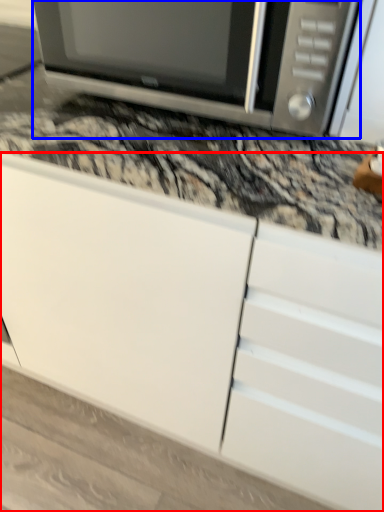
Question: Which object appears farthest to the camera in this image, cabinetry (highlighted by a red box) or microwave oven (highlighted by a blue box)?

Choices:
 (A) cabinetry
 (B) microwave oven

Answer: (B)